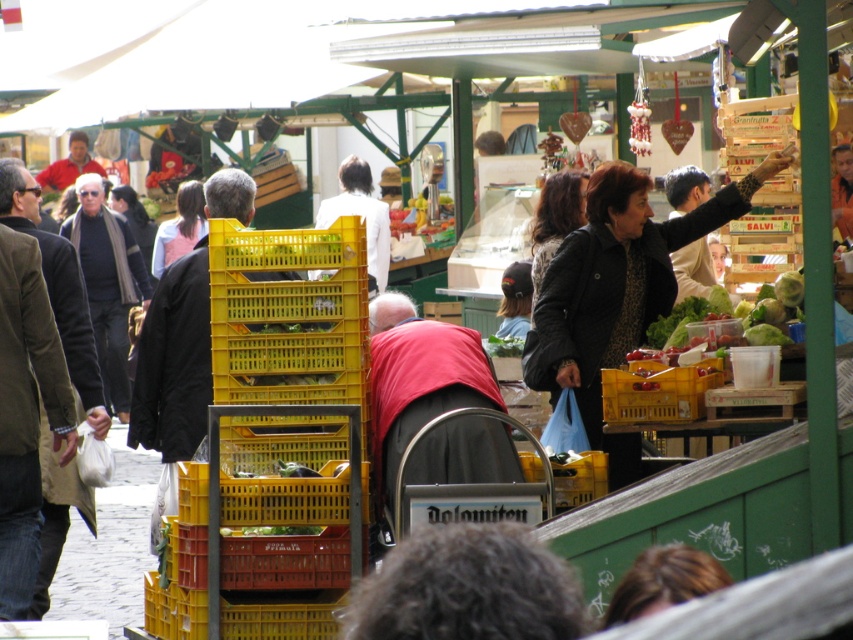
You are a photographer standing in the market and want to take a photo of the yellow plastic crate at center and the dark brown leather jacket at center. Which object is positioned closer to you?

The yellow plastic crate at center is closer to the viewer than the dark brown leather jacket at center.

You are a vendor at the market and need to place a large box that is 1 meter wide. You have space between the yellow plastic crate at center and dark brown leather jacket at center. Can the box fit in that space?

The yellow plastic crate at center is wider than the dark brown leather jacket at center. Since the box is 1 meter wide, the space between them might accommodate it, but the exact fit depends on the total width available between the two objects. However, since the crate is wider, it suggests the space could be sufficient, but without precise measurements, we can only assume based on the given information that the crate is wider, so the space might be enough.

You are a photographer trying to capture the market scene. You want to ensure that both the black textured coat at upper right and the green leafy lettuce at center are clearly visible in your photo. Given their sizes, which object might require more careful framing to ensure it doesn not get lost in the busy background?

The green leafy lettuce at center might require more careful framing because the black textured coat at upper right is wider than the green leafy lettuce at center, making it potentially more noticeable against the busy background.